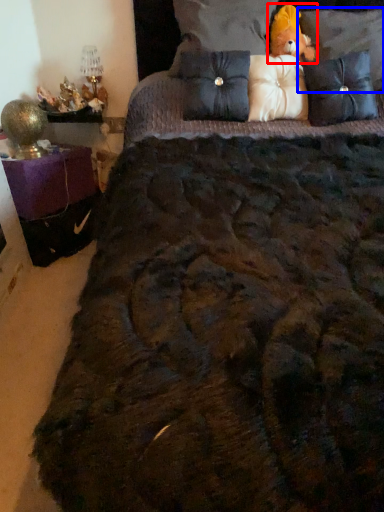
Question: Which object appears farthest to the camera in this image, figurine (highlighted by a red box) or pillow (highlighted by a blue box)?

Choices:
 (A) figurine
 (B) pillow

Answer: (A)